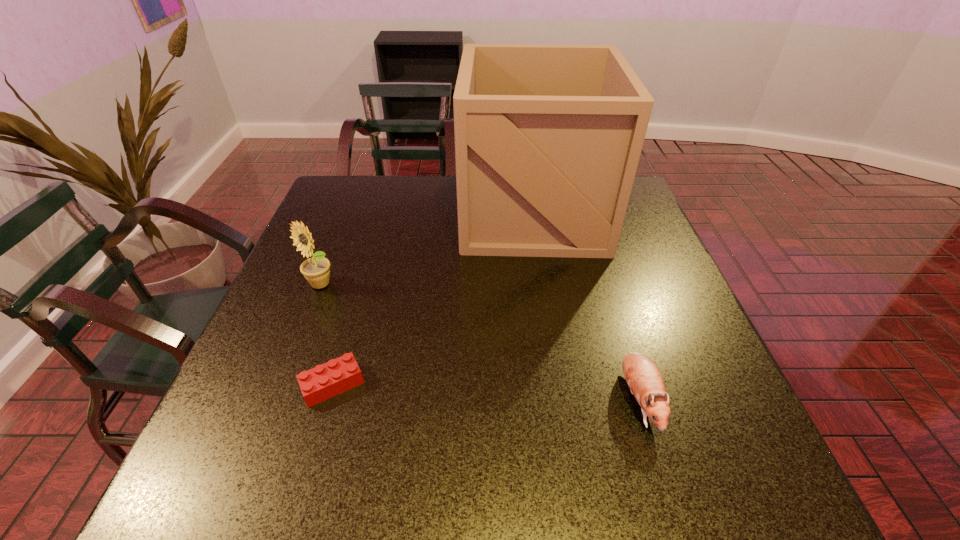
Where is `the farthest object`? the farthest object is located at coordinates (548, 138).

The width and height of the screenshot is (960, 540). What are the coordinates of `the tallest object` in the screenshot? It's located at (548, 138).

This screenshot has height=540, width=960. I want to click on sunflower, so click(316, 270).

You are a GUI agent. You are given a task and a screenshot of the screen. Output one action in this format:
    pyautogui.click(x=<x>, y=<y>)
    Task: Click on the second farthest object
    Image resolution: width=960 pixels, height=540 pixels.
    Given the screenshot: What is the action you would take?
    pyautogui.click(x=316, y=270)

The width and height of the screenshot is (960, 540). What are the coordinates of `hamster` in the screenshot? It's located at (643, 377).

This screenshot has width=960, height=540. In order to click on Lego in this screenshot , I will do `click(336, 376)`.

Where is `free space located on the front of the box`? The height and width of the screenshot is (540, 960). free space located on the front of the box is located at coordinates (545, 293).

This screenshot has width=960, height=540. Find the location of `vacant area located 0.080m on the face of the second farthest object`. vacant area located 0.080m on the face of the second farthest object is located at coordinates (306, 320).

Where is `vacant area located 0.310m on the right of the shortest object`? vacant area located 0.310m on the right of the shortest object is located at coordinates (522, 384).

Where is `object that is at the far edge`? The width and height of the screenshot is (960, 540). object that is at the far edge is located at coordinates (548, 138).